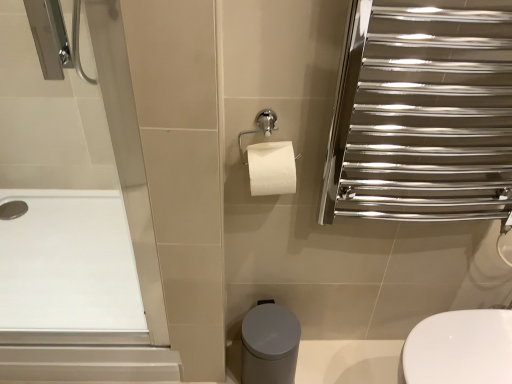
Question: Considering the relative sizes of matte gray bidet at lower center and white smooth bath at left in the image provided, is matte gray bidet at lower center bigger than white smooth bath at left?

Choices:
 (A) no
 (B) yes

Answer: (A)

Question: From a real-world perspective, is matte gray bidet at lower center positioned under white smooth bath at left based on gravity?

Choices:
 (A) yes
 (B) no

Answer: (A)

Question: Is matte gray bidet at lower center positioned before white smooth bath at left?

Choices:
 (A) no
 (B) yes

Answer: (B)

Question: Is matte gray bidet at lower center smaller than white smooth bath at left?

Choices:
 (A) yes
 (B) no

Answer: (A)

Question: Is matte gray bidet at lower center facing away from white smooth bath at left?

Choices:
 (A) yes
 (B) no

Answer: (B)

Question: From the image's perspective, is matte gray bidet at lower center located above white smooth bath at left?

Choices:
 (A) no
 (B) yes

Answer: (A)

Question: From the image's perspective, would you say polished chrome towel rack at upper right is shown under matte gray bidet at lower center?

Choices:
 (A) yes
 (B) no

Answer: (B)

Question: Is polished chrome towel rack at upper right bigger than matte gray bidet at lower center?

Choices:
 (A) no
 (B) yes

Answer: (B)

Question: From a real-world perspective, is polished chrome towel rack at upper right under matte gray bidet at lower center?

Choices:
 (A) no
 (B) yes

Answer: (A)

Question: Is polished chrome towel rack at upper right behind matte gray bidet at lower center?

Choices:
 (A) no
 (B) yes

Answer: (A)

Question: Is polished chrome towel rack at upper right at the right side of matte gray bidet at lower center?

Choices:
 (A) yes
 (B) no

Answer: (A)

Question: From a real-world perspective, is polished chrome towel rack at upper right physically above matte gray bidet at lower center?

Choices:
 (A) yes
 (B) no

Answer: (A)

Question: Is white smooth bath at left to the right of polished chrome towel rack at upper right from the viewer's perspective?

Choices:
 (A) yes
 (B) no

Answer: (B)